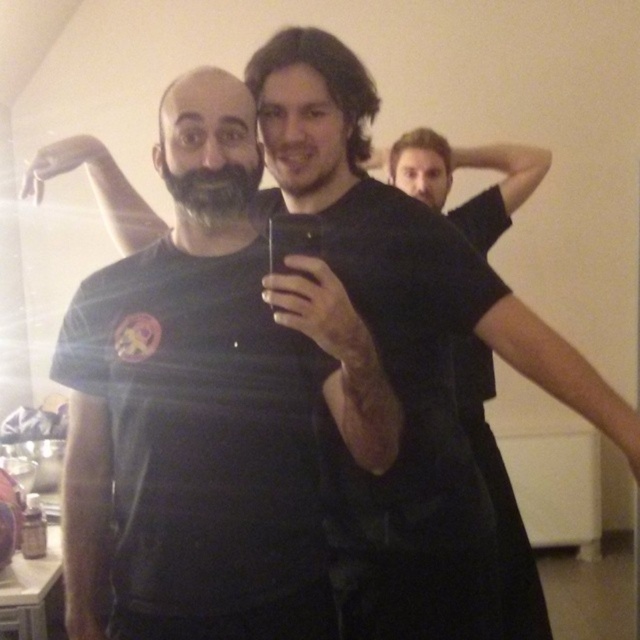
Who is positioned more to the left, black matte t-shirt at center or black matte t-shirt at right?

Positioned to the left is black matte t-shirt at center.

Is black matte t-shirt at center below black matte t-shirt at right?

Correct, black matte t-shirt at center is located below black matte t-shirt at right.

Describe the element at coordinates (205, 438) in the screenshot. I see `black matte t-shirt at center` at that location.

Find the location of `black matte t-shirt at center`. black matte t-shirt at center is located at coordinates (205, 438).

Can you confirm if black matte t-shirt at center is positioned above gray matte beard at center?

Actually, black matte t-shirt at center is below gray matte beard at center.

Is point (163, 536) less distant than point (236, 214)?

Yes, point (163, 536) is in front of point (236, 214).

At what (x,y) coordinates should I click in order to perform the action: click on black matte t-shirt at center. Please return your answer as a coordinate pair (x, y). The image size is (640, 640). Looking at the image, I should click on (205, 438).

Is black matte t-shirt at right to the right of gray matte beard at center from the viewer's perspective?

Yes, black matte t-shirt at right is to the right of gray matte beard at center.

Which is below, black matte t-shirt at right or gray matte beard at center?

gray matte beard at center is below.

Does point (529, 556) come farther from viewer compared to point (184, 177)?

Yes, it is behind point (184, 177).

Where is `black matte t-shirt at right`? This screenshot has height=640, width=640. black matte t-shirt at right is located at coordinates (467, 168).